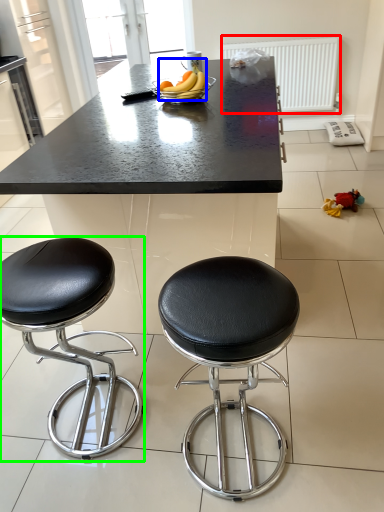
Question: Based on their relative distances, which object is farther from radiator (highlighted by a red box)? Choose from banana (highlighted by a blue box) and stool (highlighted by a green box).

Choices:
 (A) banana
 (B) stool

Answer: (B)